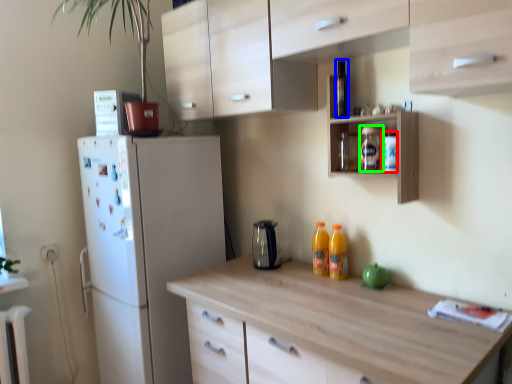
Question: Based on their relative distances, which object is farther from bottle (highlighted by a red box)? Choose from bottle (highlighted by a blue box) and bottle (highlighted by a green box).

Choices:
 (A) bottle
 (B) bottle

Answer: (A)